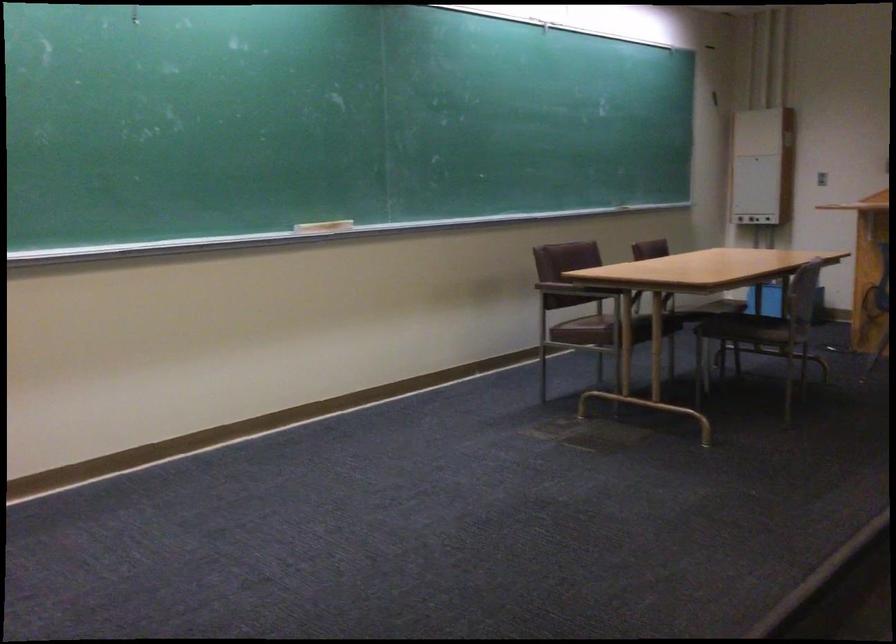
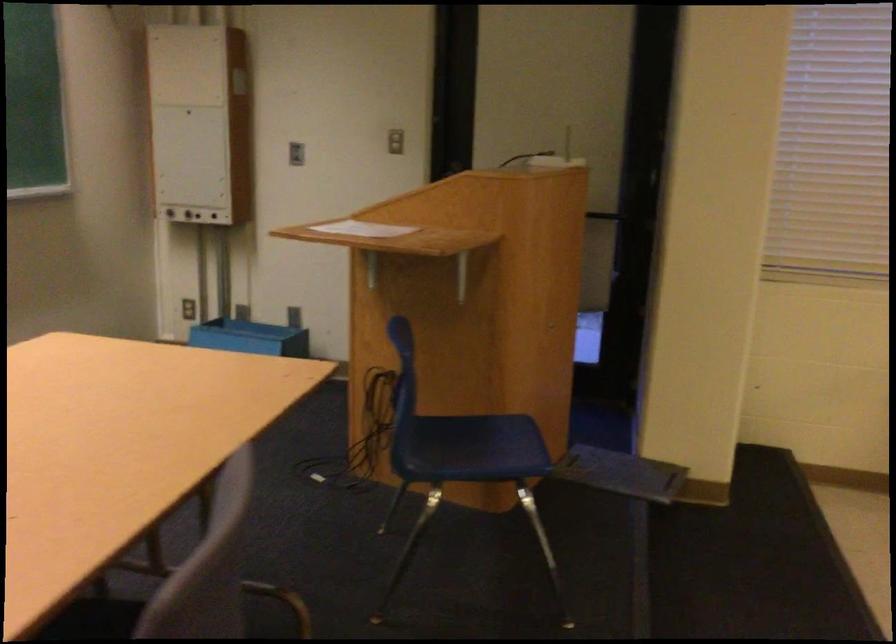
Where in the second image is the point corresponding to the point at 734,212 from the first image?

(167, 210)